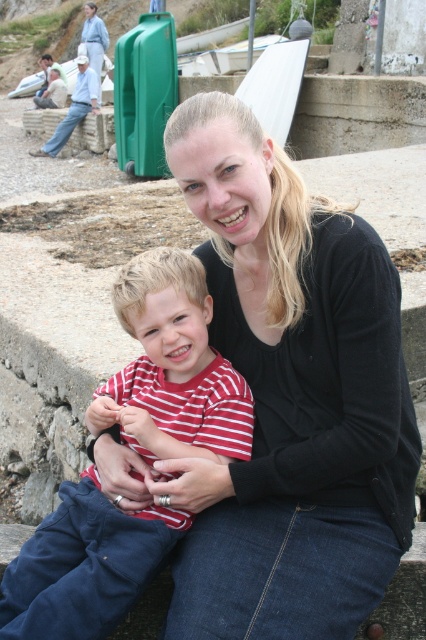
Is black matte sweater at center in front of striped fabric shirt at center?

Yes, black matte sweater at center is closer to the viewer.

Between black matte sweater at center and striped fabric shirt at center, which one is positioned higher?

black matte sweater at center is higher up.

Does point (336, 593) lie in front of point (104, 593)?

Yes, it is.

Find the location of a particular element. The height and width of the screenshot is (640, 426). black matte sweater at center is located at coordinates (284, 401).